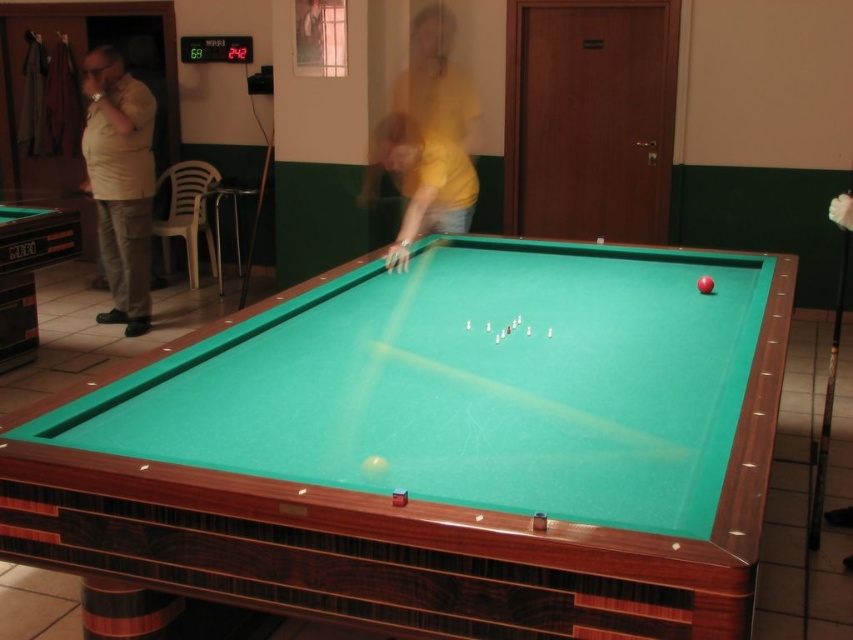
Question: Can you confirm if green felt billiard table at center is smaller than yellow matte shirt at center?

Choices:
 (A) yes
 (B) no

Answer: (B)

Question: Is green felt billiard table at center further to the viewer compared to yellow matte shirt at center?

Choices:
 (A) yes
 (B) no

Answer: (B)

Question: Which object is closer to the camera taking this photo?

Choices:
 (A) beige fabric shirt at left
 (B) yellow matte shirt at center

Answer: (B)

Question: Is green felt billiard table at center further to the viewer compared to wooden cue at center?

Choices:
 (A) no
 (B) yes

Answer: (A)

Question: Which of the following is the farthest from the observer?

Choices:
 (A) wooden cue at center
 (B) beige fabric shirt at left
 (C) green felt billiard table at center

Answer: (A)

Question: Which object is farther from the camera taking this photo?

Choices:
 (A) green felt billiard table at center
 (B) beige fabric shirt at left

Answer: (B)